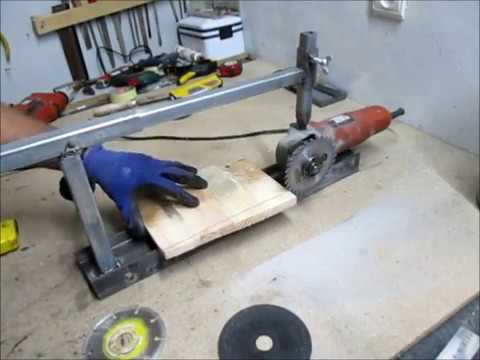
I want to click on wall molding, so click(x=387, y=7).